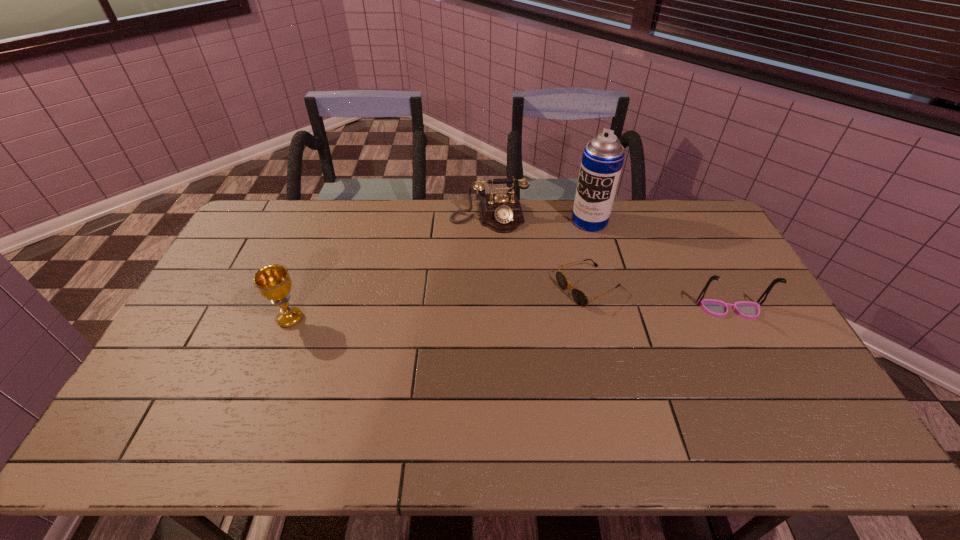
The image size is (960, 540). Identify the location of free spot on the desktop that is between the chalice and the spectacles and is positioned on the dial of the telephone. (505, 315).

At what (x,y) coordinates should I click in order to perform the action: click on free space on the desktop that is between the leftmost object and the spectacles and is positioned on the lenses of the shortest object. Please return your answer as a coordinate pair (x, y). The image size is (960, 540). Looking at the image, I should click on (535, 314).

Locate an element on the screen. The width and height of the screenshot is (960, 540). free spot on the desktop that is between the chalice and the spectacles and is positioned on the label side of the aerosol can is located at coordinates (510, 314).